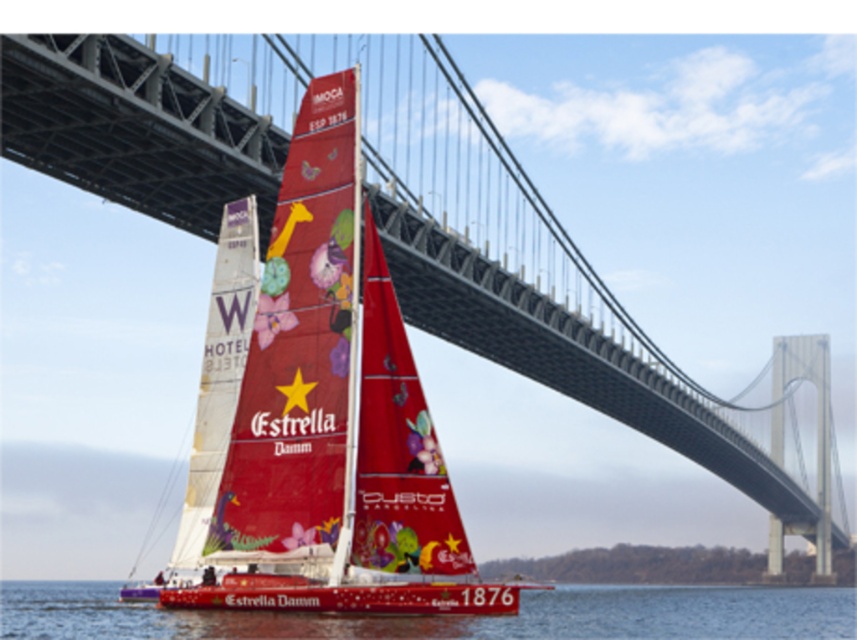
Question: Which object is farther from the camera taking this photo?

Choices:
 (A) vivid red sailboat at center
 (B) matte white sail at center

Answer: (B)

Question: Is transparent water at lower center positioned at the back of matte white sail at center?

Choices:
 (A) yes
 (B) no

Answer: (B)

Question: Does transparent water at lower center have a lesser width compared to matte white sail at center?

Choices:
 (A) yes
 (B) no

Answer: (B)

Question: Does vivid red sailboat at center have a lesser width compared to matte white sail at center?

Choices:
 (A) no
 (B) yes

Answer: (B)

Question: Which object is farther from the camera taking this photo?

Choices:
 (A) transparent water at lower center
 (B) matte white sail at center

Answer: (B)

Question: Which object is the farthest from the vivid red sailboat at center?

Choices:
 (A) transparent water at lower center
 (B) matte white sail at center

Answer: (A)